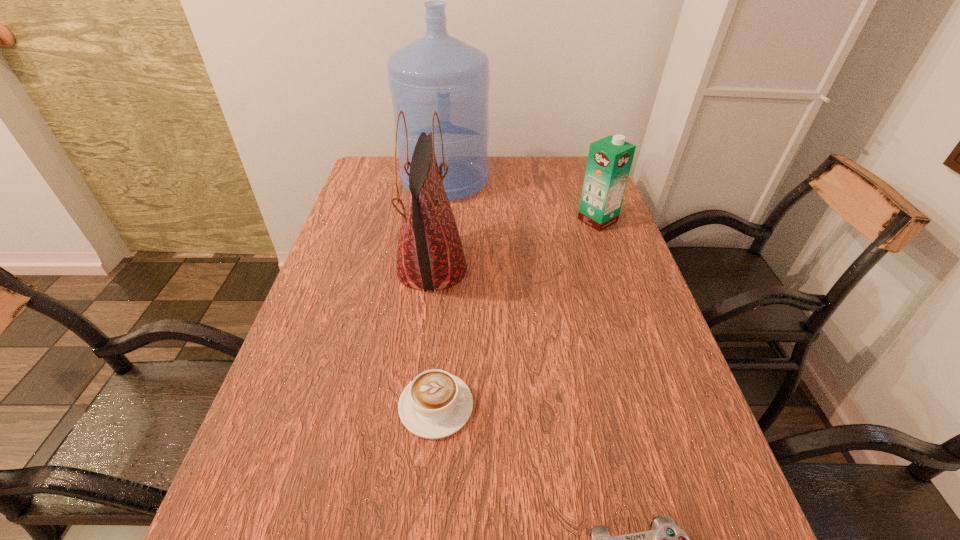
The width and height of the screenshot is (960, 540). What are the coordinates of `unoccupied position between the cappuccino and the handbag` in the screenshot? It's located at (434, 338).

Select which object is the closest to the farthest object. Please provide its 2D coordinates. Your answer should be formatted as a tuple, i.e. [(x, y)], where the tuple contains the x and y coordinates of a point satisfying the conditions above.

[(430, 256)]

Where is `the fourth closest object to the carton`? This screenshot has height=540, width=960. the fourth closest object to the carton is located at coordinates (665, 539).

Find the location of a particular element. vacant space that satisfies the following two spatial constraints: 1. on the front side of the second farthest object; 2. with the handle on the right side of the cappuccino is located at coordinates (661, 406).